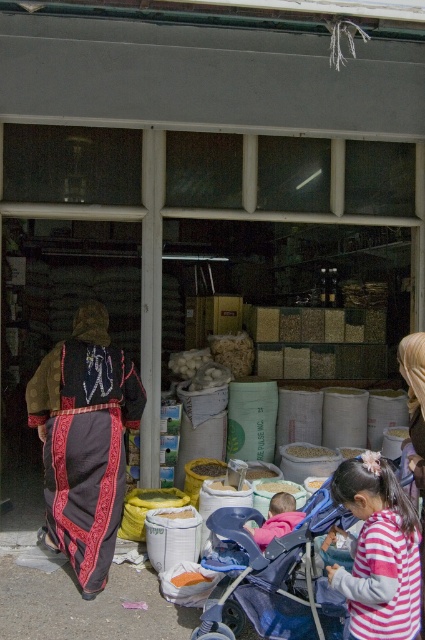
You are a customer standing in front of the shop entrance. You see both the striped cotton shirt at center and the smooth yellow powder at center. Which item is physically closer to you?

The striped cotton shirt at center is closer to the viewer than the smooth yellow powder at center, so the striped cotton shirt at center is physically closer to you.

What are the coordinates of the striped cotton shirt at center?

The striped cotton shirt at center is located at coordinates point (x=379, y=552).

You are standing at the entrance of the shop and want to reach the point marked at coordinates (285, 500). Given that the average walking distance for an adult is about 15 feet, do you think you can comfortably reach that point without needing to stretch?

The point at (285, 500) is 15.18 feet away from you. Since the average walking distance for an adult is about 15 feet, reaching it would require a slight stretch but is still within a comfortable range.